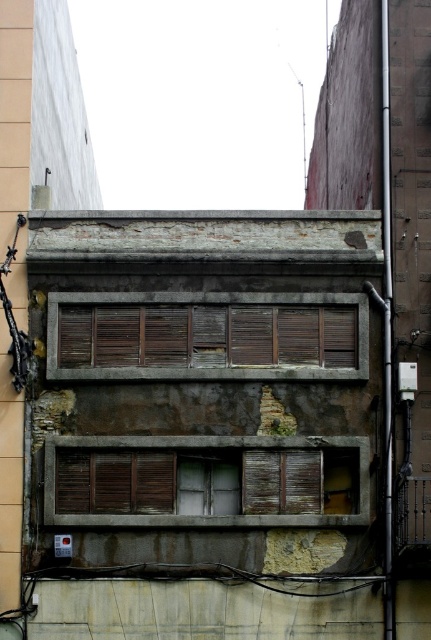
Does brown wooden shutters at center appear on the right side of wooden shutters at center?

Incorrect, brown wooden shutters at center is not on the right side of wooden shutters at center.

Between point (112, 346) and point (255, 520), which one is positioned in front?

Point (255, 520) is in front.

Locate an element on the screen. Image resolution: width=431 pixels, height=640 pixels. brown wooden shutters at center is located at coordinates (206, 337).